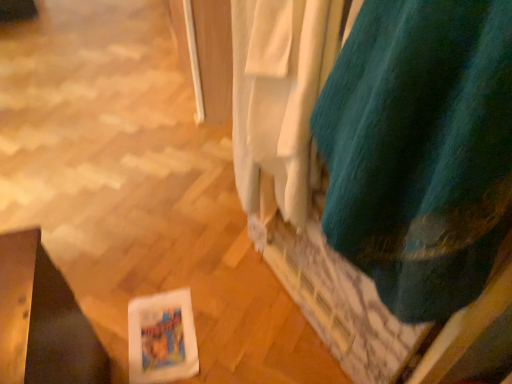
Where is `vacant space in teal fabric curtain at upper right, which is the 1th curtain in left-to-right order (from a real-world perspective)`? The image size is (512, 384). vacant space in teal fabric curtain at upper right, which is the 1th curtain in left-to-right order (from a real-world perspective) is located at coordinates (265, 301).